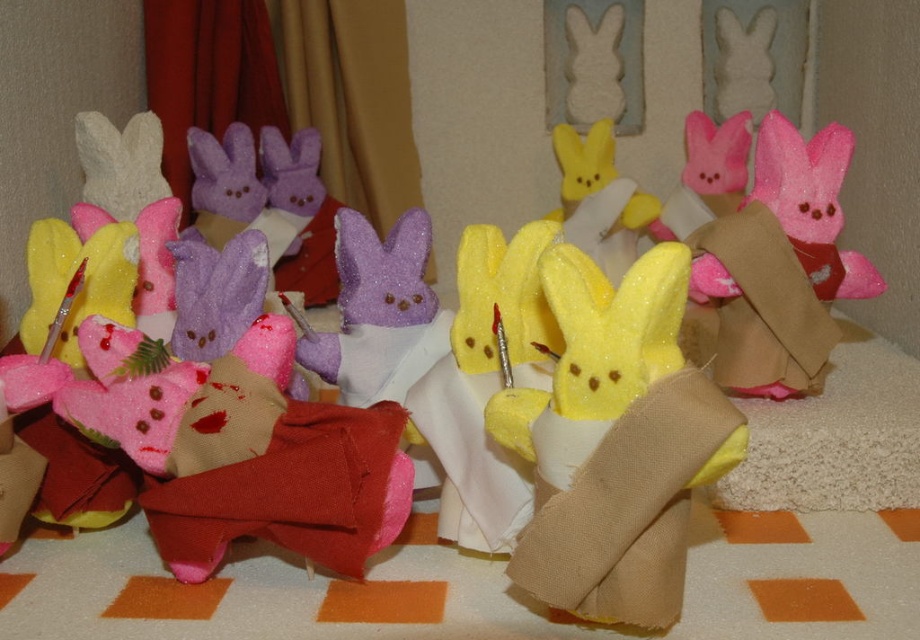
You are a child who wants to grab the glittery yellow bunny at center. Since you are 3 feet tall, can you reach it?

The glittery yellow bunny at center is 26.75 inches from camera. Since 3 feet equals 36 inches, the child can reach it because the distance is less than their height.

You are organizing a childrens party and need to place the glittery yellow bunny at center and the pink felt bunny at center into a narrow gift box. Which bunny will fit better in the box if the box is designed to accommodate thinner items?

The glittery yellow bunny at center is thinner than the pink felt bunny at center, so it will fit better in the narrow gift box designed for thinner items.

You are looking at the image of the bunnies on the cloth. There are two points marked in the image, point A at coordinates point (529,588) and point B at coordinates point (849,275). Which point is closer to you?

Point point (529,588) is closer to the viewer than point point (849,275).